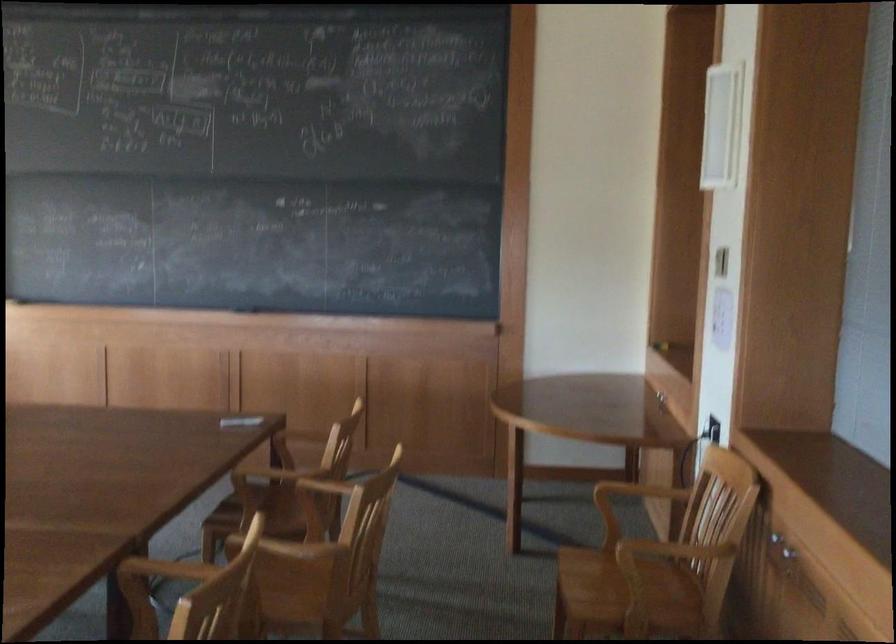
Where would you push the light switch? Please return your answer as a coordinate pair (x, y).

(724, 259)